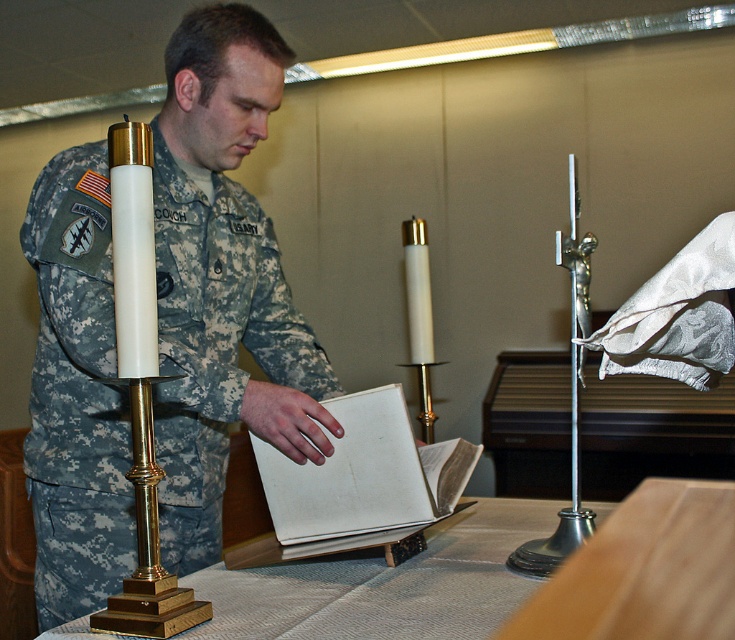
Can you confirm if off-white paper book at center is wider than white polished brass candle holder at left?

Correct, the width of off-white paper book at center exceeds that of white polished brass candle holder at left.

Does point (394, 529) come farther from viewer compared to point (96, 612)?

Yes, it is.

The width and height of the screenshot is (735, 640). What are the coordinates of `off-white paper book at center` in the screenshot? It's located at (362, 480).

Is camouflage fabric uniform at center thinner than white polished brass candle holder at left?

In fact, camouflage fabric uniform at center might be wider than white polished brass candle holder at left.

Which is more to the right, camouflage fabric uniform at center or white polished brass candle holder at left?

white polished brass candle holder at left is more to the right.

Which is in front, point (215, 381) or point (154, 618)?

Point (154, 618) is in front.

The width and height of the screenshot is (735, 640). In order to click on camouflage fabric uniform at center in this screenshot , I will do `click(215, 344)`.

Between camouflage fabric uniform at center and off-white paper book at center, which one is positioned lower?

off-white paper book at center is below.

Can you confirm if camouflage fabric uniform at center is positioned below off-white paper book at center?

No.

Where is `camouflage fabric uniform at center`? This screenshot has height=640, width=735. camouflage fabric uniform at center is located at coordinates (215, 344).

You are a GUI agent. You are given a task and a screenshot of the screen. Output one action in this format:
    pyautogui.click(x=<x>, y=<y>)
    Task: Click on the camouflage fabric uniform at center
    The height and width of the screenshot is (640, 735).
    Given the screenshot: What is the action you would take?
    pyautogui.click(x=215, y=344)